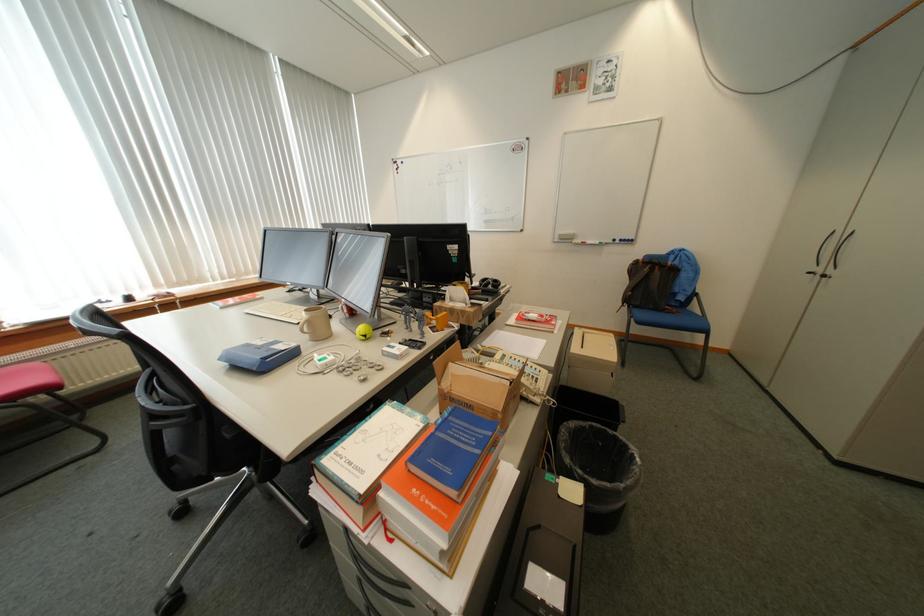
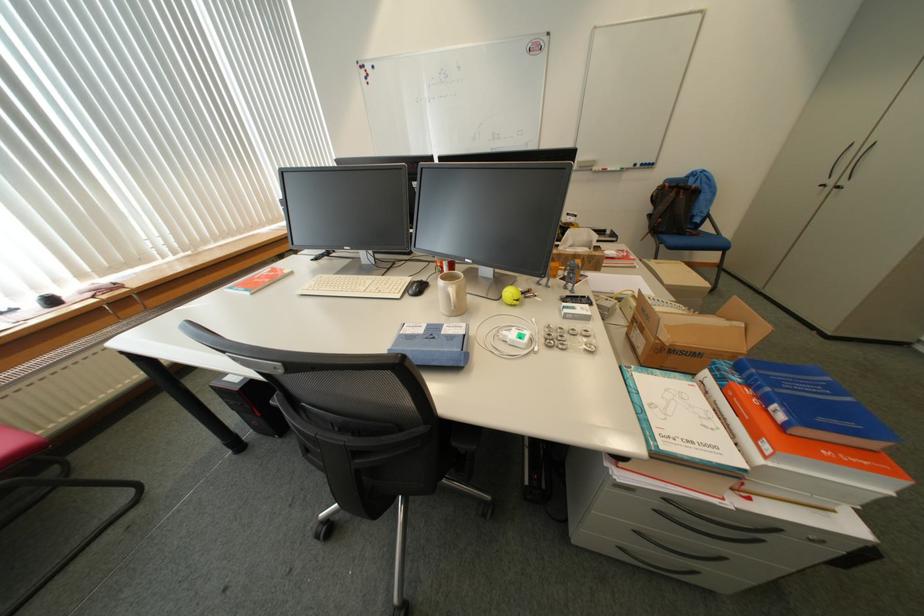
In the second image, find the point that corresponds to pixel 313 354 in the first image.

(481, 334)